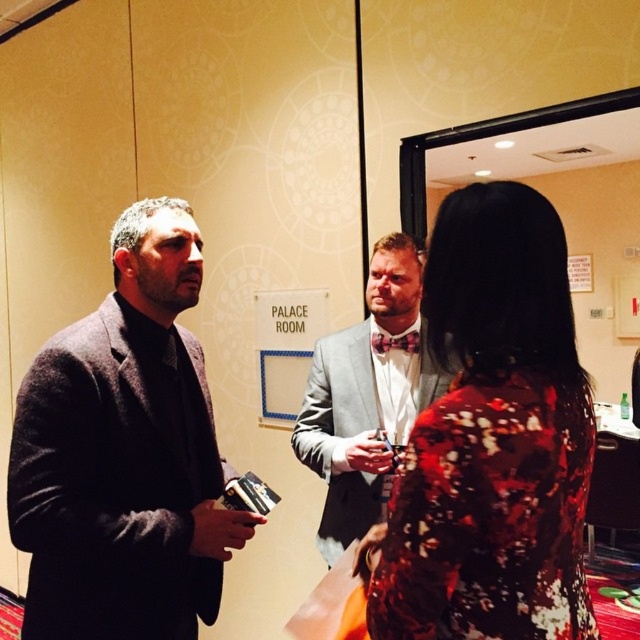
Question: Can you confirm if dark wool suit at left is wider than silver metallic suit at center?

Choices:
 (A) no
 (B) yes

Answer: (B)

Question: Which of the following is the farthest from the observer?

Choices:
 (A) (401, 339)
 (B) (451, 458)
 (C) (301, 436)
 (D) (54, 419)

Answer: (C)

Question: Which point appears closest to the camera in this image?

Choices:
 (A) (412, 339)
 (B) (515, 269)
 (C) (304, 397)
 (D) (86, 355)

Answer: (B)

Question: Can you confirm if floral dress at center is bigger than shiny red bow tie at center?

Choices:
 (A) yes
 (B) no

Answer: (A)

Question: Estimate the real-world distances between objects in this image. Which object is closer to the silver metallic suit at center?

Choices:
 (A) floral dress at center
 (B) dark wool suit at left
 (C) shiny red bow tie at center

Answer: (C)

Question: Is floral dress at center above silver metallic suit at center?

Choices:
 (A) yes
 (B) no

Answer: (A)